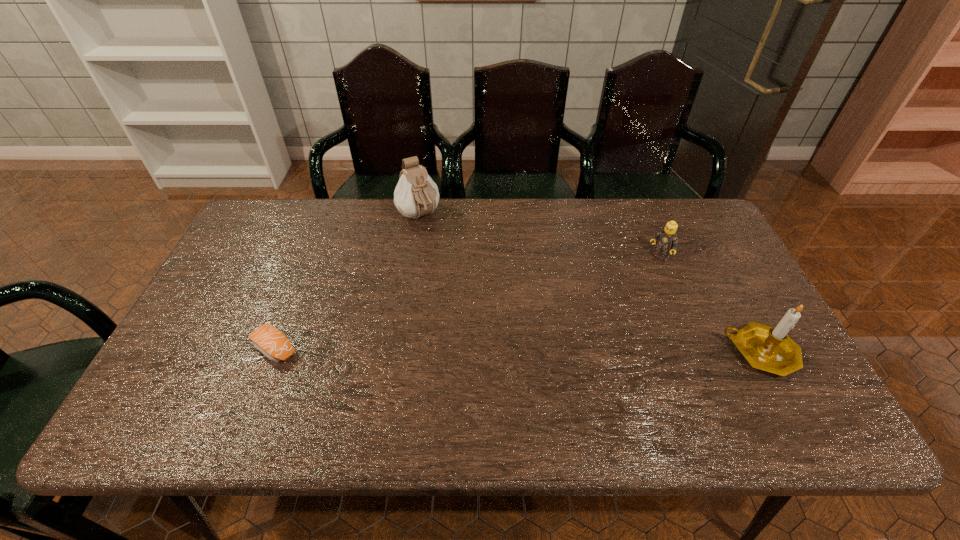
Locate an element on the screen. free space located 0.230m with a handle on the candle holder is located at coordinates 632,353.

Locate an element on the screen. vacant space located in front of the Lego is located at coordinates (620, 294).

The height and width of the screenshot is (540, 960). In order to click on free space located in front of the Lego in this screenshot , I will do `click(572, 340)`.

Image resolution: width=960 pixels, height=540 pixels. Find the location of `free location located in front of the Lego`. free location located in front of the Lego is located at coordinates (604, 310).

This screenshot has height=540, width=960. What are the coordinates of `free space located on the front-facing side of the second object from left to right` in the screenshot? It's located at (496, 310).

Image resolution: width=960 pixels, height=540 pixels. Identify the location of free location located on the front-facing side of the second object from left to right. (442, 247).

I want to click on free space located on the front-facing side of the second object from left to right, so click(462, 270).

Locate an element on the screen. The image size is (960, 540). object present at the far edge is located at coordinates click(x=416, y=194).

Identify the location of sushi located at the near edge. The image size is (960, 540). (269, 340).

Find the location of a particular element. candle holder that is at the near edge is located at coordinates (767, 348).